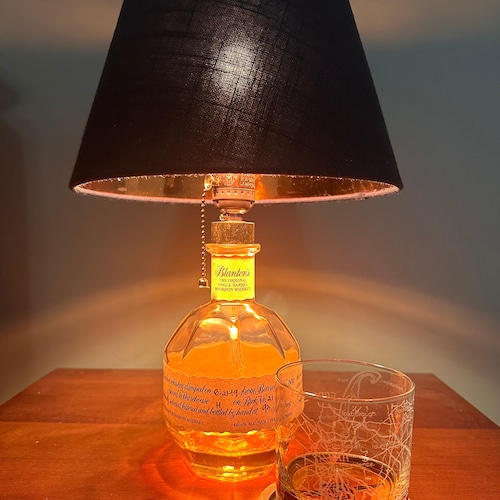
Where is `lamp`? This screenshot has height=500, width=500. lamp is located at coordinates (243, 331).